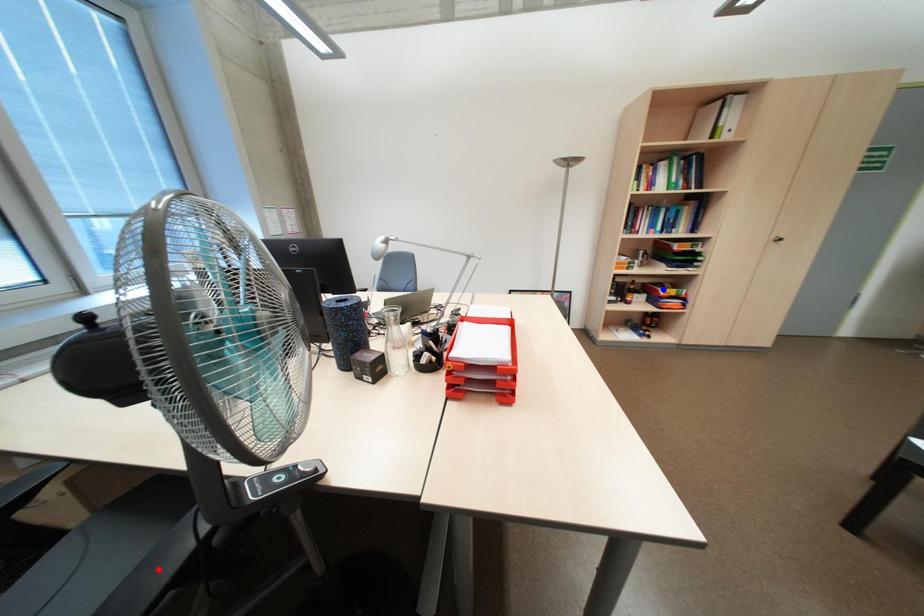
Question: Two points are marked on the image. Which point is closer to the camera?

Choices:
 (A) Blue point is closer.
 (B) Red point is closer.

Answer: (B)